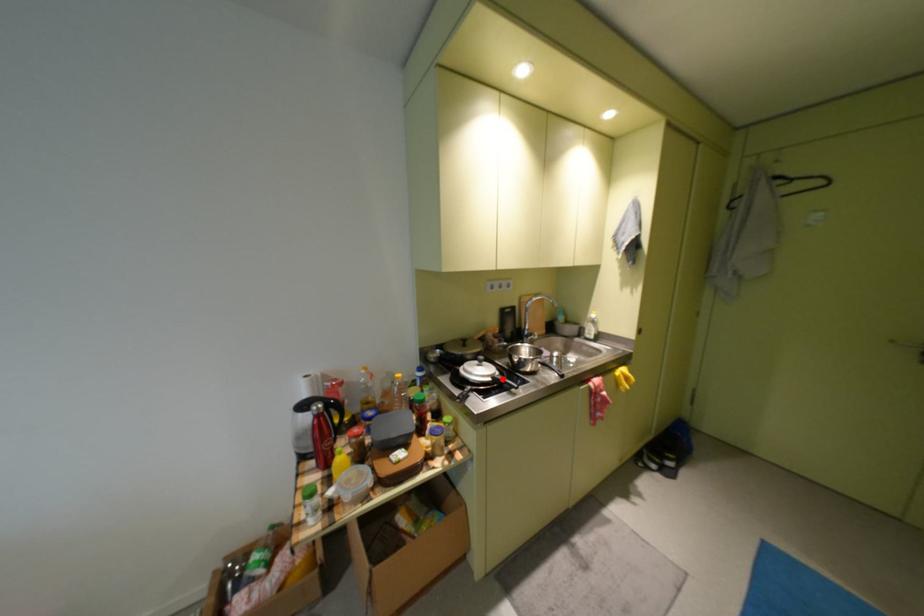
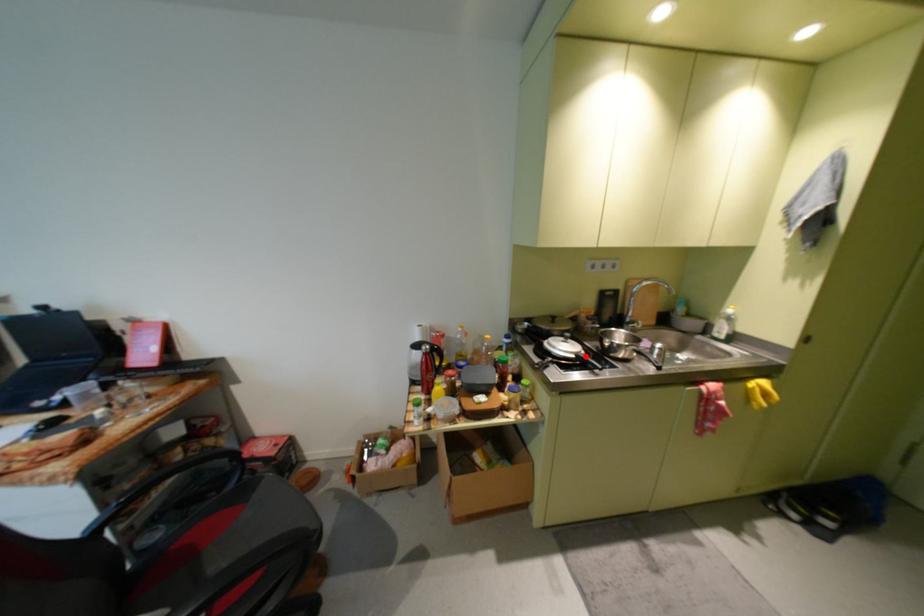
I am providing you with two images of the same scene from different viewpoints. A red point is marked on the first image and another point is marked on the second image. Is the marked point in image1 the same physical position as the marked point in image2?

Yes